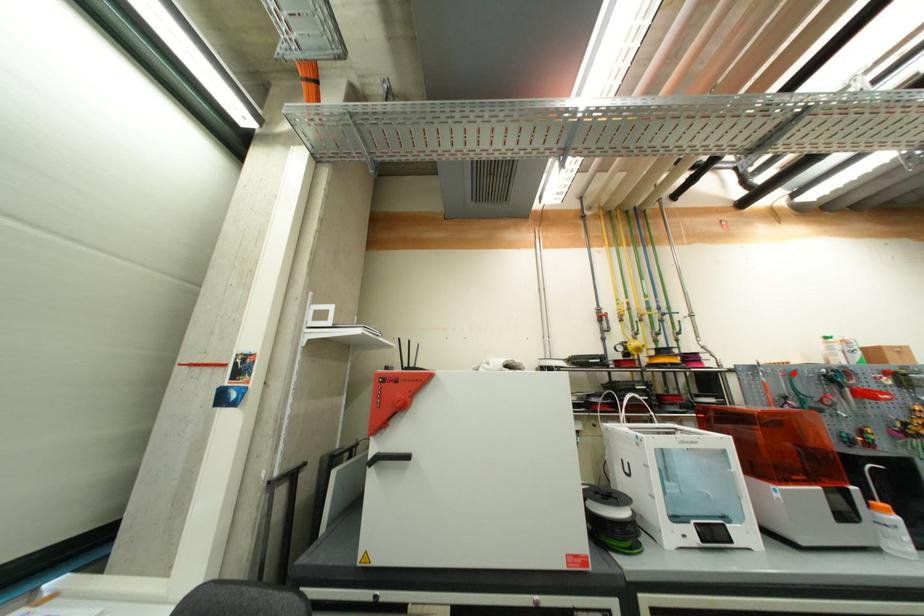
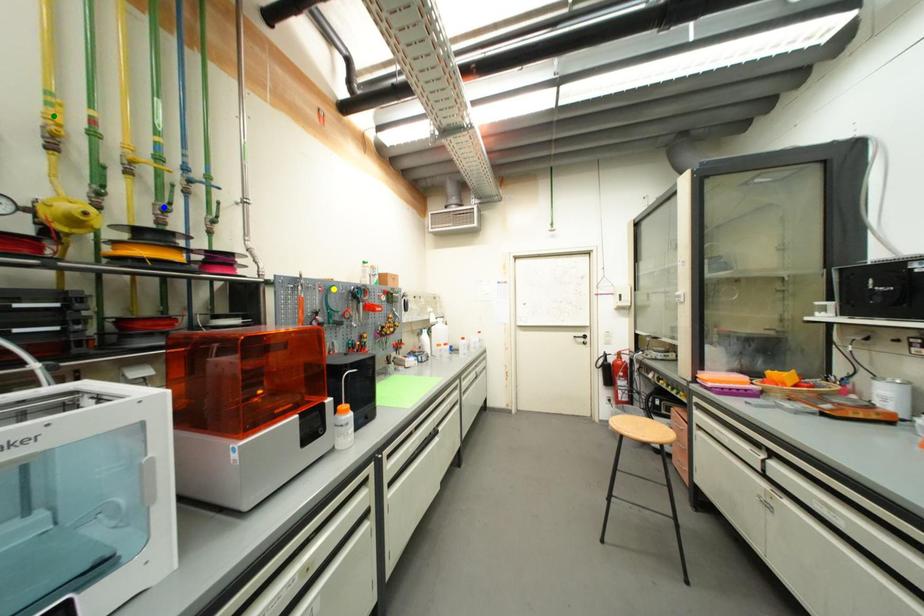
Question: I am providing you with two images of the same scene from different viewpoints. A red point is marked on the first image. You are given multiple points on the second image. Which point in image 2 represents the same 3d spot as the red point in image 1?

Choices:
 (A) blue point
 (B) green point
 (C) yellow point

Answer: (C)